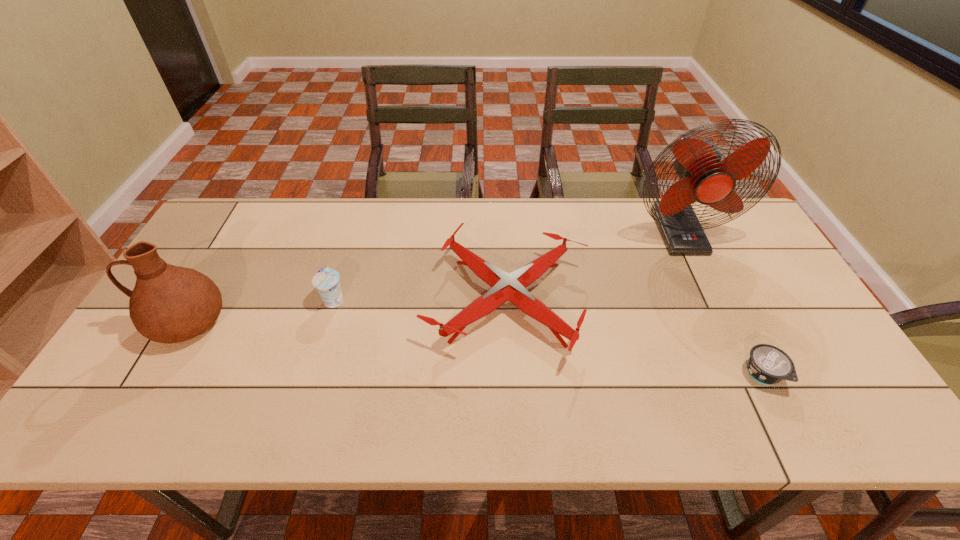
Locate an element on the screen. empty space that is in between the fan and the leftmost object is located at coordinates (433, 278).

Identify the location of vacant area between the drone and the pitcher. The image size is (960, 540). (348, 312).

Where is `object that is the closest to the taller yogurt`? This screenshot has height=540, width=960. object that is the closest to the taller yogurt is located at coordinates (511, 287).

Identify which object is the second closest to the fan. Please provide its 2D coordinates. Your answer should be formatted as a tuple, i.e. [(x, y)], where the tuple contains the x and y coordinates of a point satisfying the conditions above.

[(767, 364)]

The width and height of the screenshot is (960, 540). I want to click on vacant space that satisfies the following two spatial constraints: 1. on the side of the leftmost object with the handle; 2. on the left side of the right yogurt, so click(x=156, y=375).

The image size is (960, 540). What are the coordinates of `vacant area in the image that satisfies the following two spatial constraints: 1. on the side of the shortest object with the handle; 2. on the left side of the leftmost object` in the screenshot? It's located at (156, 375).

At what (x,y) coordinates should I click in order to perform the action: click on vacant region that satisfies the following two spatial constraints: 1. on the side of the shorter yogurt with the handle; 2. on the left side of the leftmost object. Please return your answer as a coordinate pair (x, y). The height and width of the screenshot is (540, 960). Looking at the image, I should click on (156, 375).

Identify the location of free space that satisfies the following two spatial constraints: 1. on the front side of the drone; 2. on the left side of the shorter yogurt. The height and width of the screenshot is (540, 960). (512, 375).

What are the coordinates of `vacant area that satisfies the following two spatial constraints: 1. on the front side of the drone; 2. on the left side of the right yogurt` in the screenshot? It's located at (512, 375).

You are a GUI agent. You are given a task and a screenshot of the screen. Output one action in this format:
    pyautogui.click(x=<x>, y=<y>)
    Task: Click on the free region that satisfies the following two spatial constraints: 1. on the front-facing side of the shorter yogurt; 2. on the left side of the fan
    
    Given the screenshot: What is the action you would take?
    pyautogui.click(x=748, y=375)